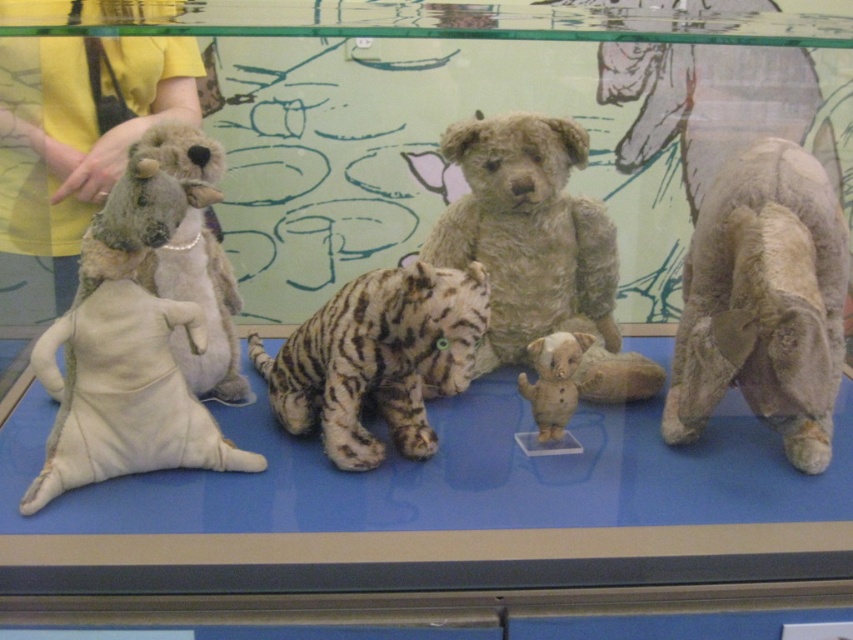
Does white plush kangaroo at left come behind striped fur tiger at center?

No.

The image size is (853, 640). I want to click on white plush kangaroo at left, so click(126, 353).

Is white plush kangaroo at left positioned before white plush elephant at center?

Yes, white plush kangaroo at left is in front of white plush elephant at center.

Looking at this image, who is shorter, white plush kangaroo at left or white plush elephant at center?

white plush elephant at center

Is point (135, 314) positioned after point (556, 348)?

No, (135, 314) is in front of (556, 348).

At what (x,y) coordinates should I click in order to perform the action: click on white plush kangaroo at left. Please return your answer as a coordinate pair (x, y). This screenshot has height=640, width=853. Looking at the image, I should click on (126, 353).

Which is behind, point (634, 374) or point (289, 344)?

Positioned behind is point (634, 374).

Consider the image. Is fuzzy brown teddy bear at center positioned behind striped fur tiger at center?

Yes, fuzzy brown teddy bear at center is further from the viewer.

What are the coordinates of `fuzzy brown teddy bear at center` in the screenshot? It's located at (537, 248).

At what (x,y) coordinates should I click in order to perform the action: click on fuzzy brown teddy bear at center. Please return your answer as a coordinate pair (x, y). Image resolution: width=853 pixels, height=640 pixels. Looking at the image, I should click on (537, 248).